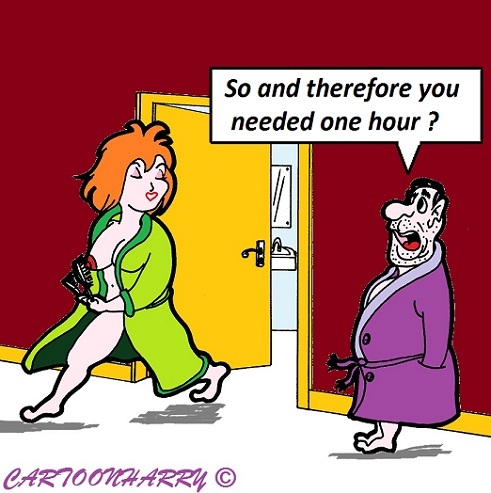
Where is `purple robe`? Image resolution: width=491 pixels, height=493 pixels. purple robe is located at coordinates (393, 332).